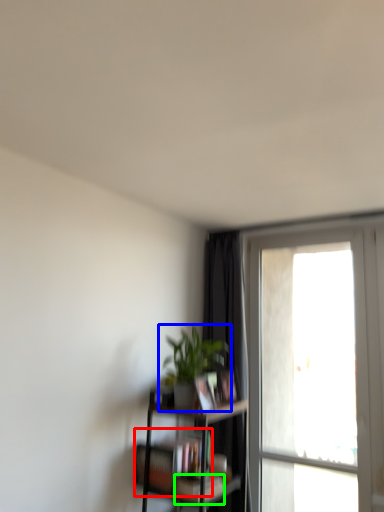
Question: Which object is positioned farthest from book (highlighted by a red box)? Select from houseplant (highlighted by a blue box) and book (highlighted by a green box).

Choices:
 (A) houseplant
 (B) book

Answer: (A)